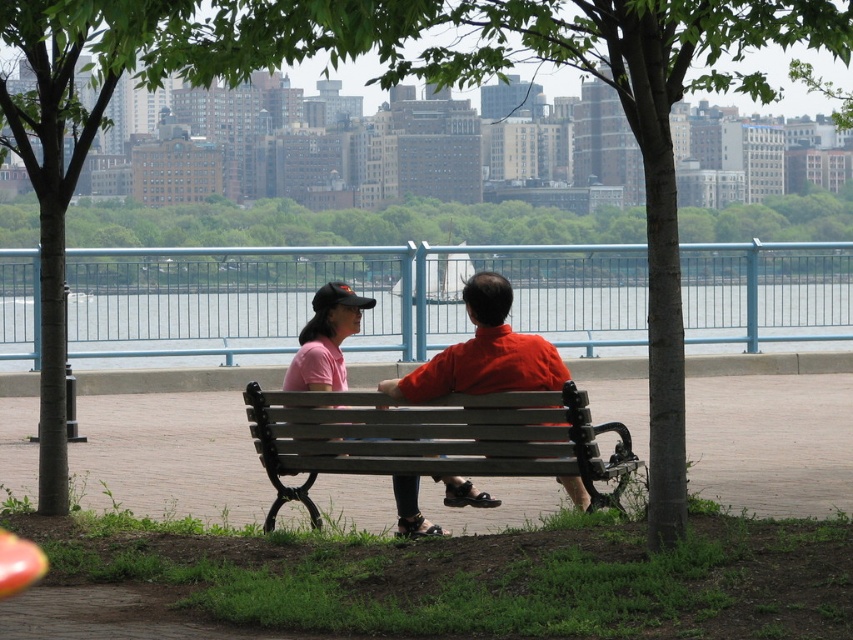
Is wooden bench at center to the left of matte pink shirt at center from the viewer's perspective?

No, wooden bench at center is not to the left of matte pink shirt at center.

Does wooden bench at center appear over matte pink shirt at center?

Actually, wooden bench at center is below matte pink shirt at center.

Between point (465, 468) and point (415, 513), which one is positioned behind?

The point (415, 513) is behind.

Identify the location of wooden bench at center. (431, 440).

Is matte orange shirt at center bigger than matte pink shirt at center?

Indeed, matte orange shirt at center has a larger size compared to matte pink shirt at center.

Does matte orange shirt at center appear over matte pink shirt at center?

No, matte orange shirt at center is not above matte pink shirt at center.

I want to click on matte orange shirt at center, so click(x=485, y=353).

Is point (447, 344) less distant than point (393, 445)?

That is False.

Is point (149, 323) farther from viewer compared to point (285, 470)?

Yes.

Describe the element at coordinates (180, 323) in the screenshot. This screenshot has width=853, height=640. I see `blue water at center` at that location.

Locate an element on the screen. Image resolution: width=853 pixels, height=640 pixels. blue water at center is located at coordinates (180, 323).